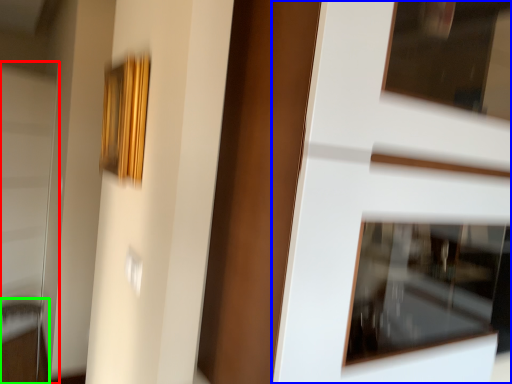
Question: Which object is positioned farthest from screen door (highlighted by a red box)? Select from door (highlighted by a blue box) and furniture (highlighted by a green box).

Choices:
 (A) door
 (B) furniture

Answer: (A)